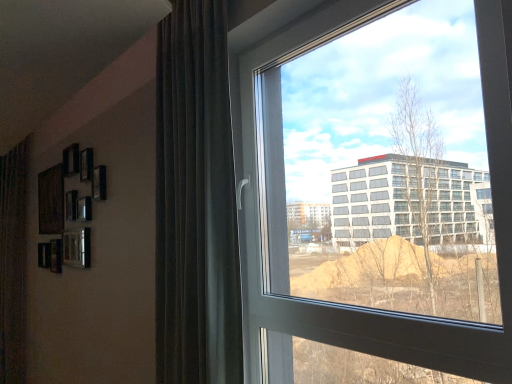
The height and width of the screenshot is (384, 512). What do you see at coordinates (196, 202) in the screenshot? I see `dark brown velvet curtain at left` at bounding box center [196, 202].

Find the location of `dark brown velvet curtain at left`. dark brown velvet curtain at left is located at coordinates (196, 202).

This screenshot has height=384, width=512. What do you see at coordinates (285, 222) in the screenshot?
I see `transparent glass window at center` at bounding box center [285, 222].

You are a GUI agent. You are given a task and a screenshot of the screen. Output one action in this format:
    pyautogui.click(x=<x>, y=<y>)
    Task: Click on the transparent glass window at center
    
    Given the screenshot: What is the action you would take?
    pyautogui.click(x=285, y=222)

Where is `dark brown velvet curtain at left`? dark brown velvet curtain at left is located at coordinates tap(196, 202).

Considering the positions of objects dark brown velvet curtain at left and transparent glass window at center in the image provided, who is more to the left, dark brown velvet curtain at left or transparent glass window at center?

dark brown velvet curtain at left is more to the left.

Which object is further away from the camera, dark brown velvet curtain at left or transparent glass window at center?

dark brown velvet curtain at left is behind.

Does point (193, 290) come behind point (478, 330)?

Yes, point (193, 290) is behind point (478, 330).

Looking at this image, from the image's perspective, is dark brown velvet curtain at left located above or below transparent glass window at center?

dark brown velvet curtain at left is above transparent glass window at center.

From a real-world perspective, is dark brown velvet curtain at left above or below transparent glass window at center?

dark brown velvet curtain at left is above transparent glass window at center.

Does dark brown velvet curtain at left have a lesser width compared to transparent glass window at center?

Incorrect, the width of dark brown velvet curtain at left is not less than that of transparent glass window at center.

From their relative heights in the image, would you say dark brown velvet curtain at left is taller or shorter than transparent glass window at center?

dark brown velvet curtain at left is taller than transparent glass window at center.

Between dark brown velvet curtain at left and transparent glass window at center, which one has larger size?

dark brown velvet curtain at left is bigger.

Is dark brown velvet curtain at left located outside transparent glass window at center?

That's correct, dark brown velvet curtain at left is outside of transparent glass window at center.

Is dark brown velvet curtain at left placed right next to transparent glass window at center?

No, dark brown velvet curtain at left is not touching transparent glass window at center.

Is dark brown velvet curtain at left oriented towards transparent glass window at center?

No, dark brown velvet curtain at left is not aimed at transparent glass window at center.

How different are the orientations of dark brown velvet curtain at left and transparent glass window at center in degrees?

1.8 degrees.

The width and height of the screenshot is (512, 384). What are the coordinates of `window in front of the dark brown velvet curtain at left` in the screenshot? It's located at pyautogui.click(x=285, y=222).

Is transparent glass window at center to the right of dark brown velvet curtain at left from the viewer's perspective?

Yes, transparent glass window at center is to the right of dark brown velvet curtain at left.

Is the position of transparent glass window at center more distant than that of dark brown velvet curtain at left?

No, it is not.

Considering the positions of points (267, 136) and (156, 195), is point (267, 136) closer to camera compared to point (156, 195)?

That is False.

From the image's perspective, would you say transparent glass window at center is positioned over dark brown velvet curtain at left?

No.

From a real-world perspective, which is physically above, transparent glass window at center or dark brown velvet curtain at left?

dark brown velvet curtain at left, from a real-world perspective.

Does transparent glass window at center have a lesser width compared to dark brown velvet curtain at left?

Yes.

Which of these two, transparent glass window at center or dark brown velvet curtain at left, stands shorter?

transparent glass window at center is shorter.

Can you confirm if transparent glass window at center is bigger than dark brown velvet curtain at left?

Incorrect, transparent glass window at center is not larger than dark brown velvet curtain at left.

Is dark brown velvet curtain at left surrounded by transparent glass window at center?

No, dark brown velvet curtain at left is not surrounded by transparent glass window at center.

Would you consider transparent glass window at center to be distant from dark brown velvet curtain at left?

They are positioned close to each other.

Could you tell me if transparent glass window at center is turned towards dark brown velvet curtain at left?

No, transparent glass window at center does not turn towards dark brown velvet curtain at left.

How distant is transparent glass window at center from dark brown velvet curtain at left?

transparent glass window at center and dark brown velvet curtain at left are 11.46 inches apart from each other.

Locate an element on the screen. curtain located on the left of transparent glass window at center is located at coordinates (196, 202).

The width and height of the screenshot is (512, 384). In order to click on window that appears in front of the dark brown velvet curtain at left in this screenshot , I will do pyautogui.click(x=285, y=222).

I want to click on curtain that appears on the left of transparent glass window at center, so click(x=196, y=202).